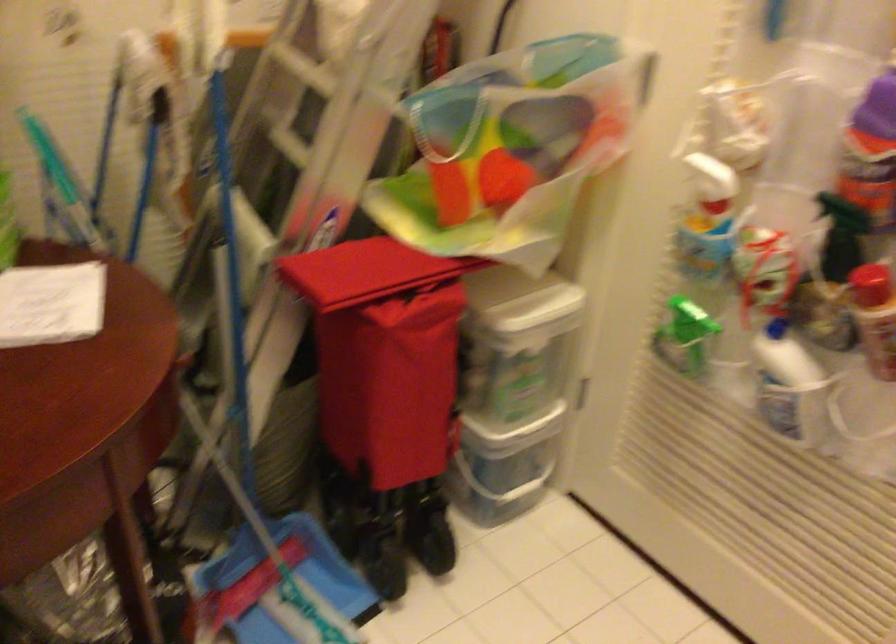
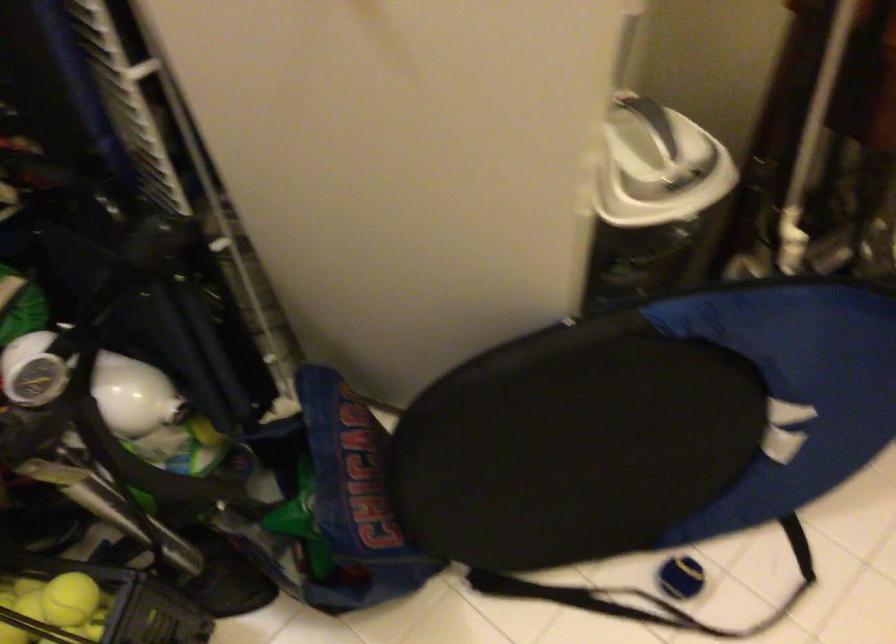
The first image is from the beginning of the video and the second image is from the end. How did the camera likely rotate when shooting the video?

The camera's rotation is toward left-down.